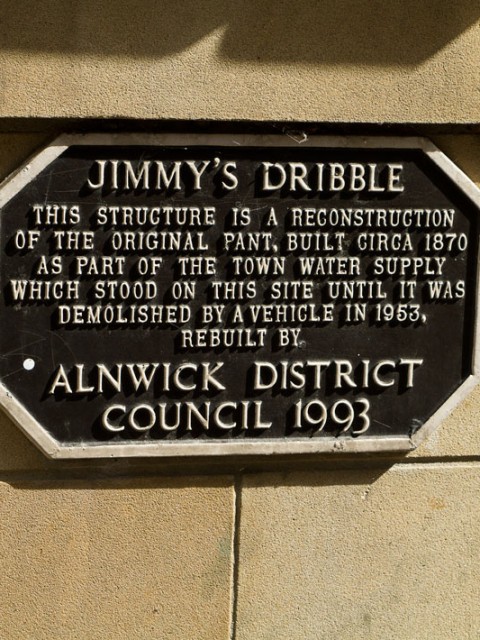
Identify the location of beige bricks under sign on wall. (183, 554), (323, 556).